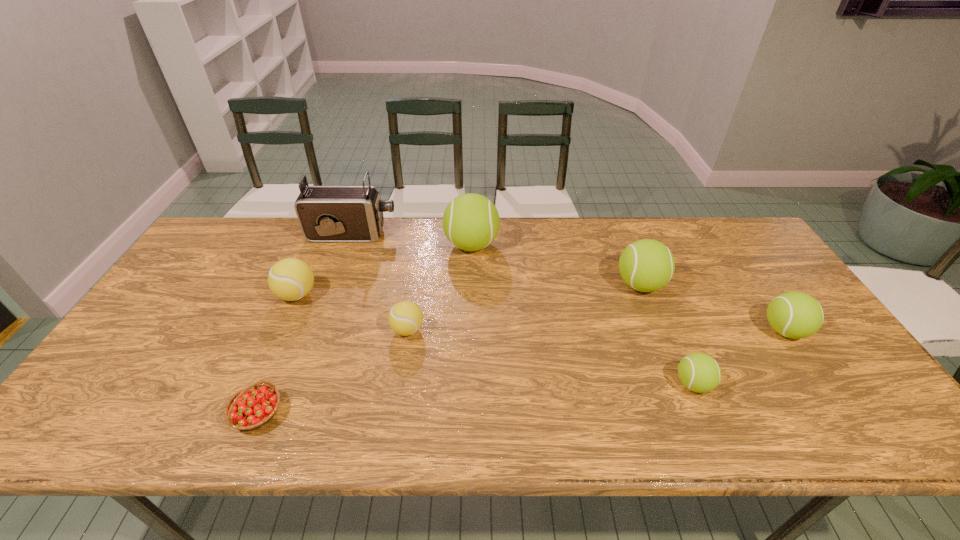
Locate an element on the screen. The width and height of the screenshot is (960, 540). free spot between the smaller yellow tennis ball and the farther yellow tennis ball is located at coordinates (352, 312).

Locate an element on the screen. The height and width of the screenshot is (540, 960). the seventh closest object to the tallest object is located at coordinates (796, 315).

Point out which object is positioned as the seventh nearest to the smaller yellow tennis ball. Please provide its 2D coordinates. Your answer should be formatted as a tuple, i.e. [(x, y)], where the tuple contains the x and y coordinates of a point satisfying the conditions above.

[(796, 315)]

The width and height of the screenshot is (960, 540). Identify the location of the closest tennis ball to the second tallest object. (405, 318).

Where is `tennis ball that can be found as the sixth closest to the strawberry`? tennis ball that can be found as the sixth closest to the strawberry is located at coordinates (796, 315).

The image size is (960, 540). What are the coordinates of `the second closest green tennis ball relative to the nearest green tennis ball` in the screenshot? It's located at (646, 265).

Identify which green tennis ball is located as the third nearest to the left yellow tennis ball. Please provide its 2D coordinates. Your answer should be formatted as a tuple, i.e. [(x, y)], where the tuple contains the x and y coordinates of a point satisfying the conditions above.

[(699, 372)]

Where is `free space that satisfies the following two spatial constraints: 1. at the lens of the tallest object; 2. on the back side of the rightmost object`? The height and width of the screenshot is (540, 960). free space that satisfies the following two spatial constraints: 1. at the lens of the tallest object; 2. on the back side of the rightmost object is located at coordinates (318, 330).

Locate an element on the screen. blank space that satisfies the following two spatial constraints: 1. at the lens of the tallest object; 2. on the back side of the third nearest green tennis ball is located at coordinates (334, 285).

Where is `vacant space that satisfies the following two spatial constraints: 1. on the back side of the farthest tennis ball; 2. at the lens of the tallest object`? This screenshot has width=960, height=540. vacant space that satisfies the following two spatial constraints: 1. on the back side of the farthest tennis ball; 2. at the lens of the tallest object is located at coordinates (471, 234).